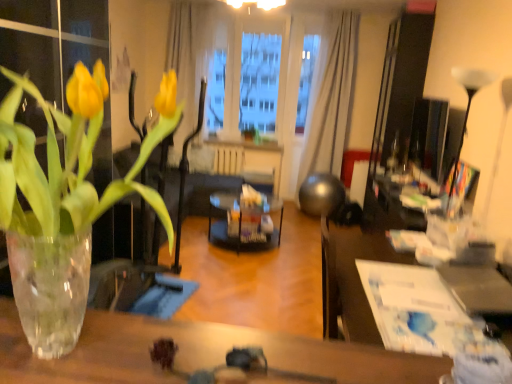
Where is `free spot above transparent glass table at lower center, the 2th table from the right (from a real-world perspective)`? Image resolution: width=512 pixels, height=384 pixels. free spot above transparent glass table at lower center, the 2th table from the right (from a real-world perspective) is located at coordinates (186, 355).